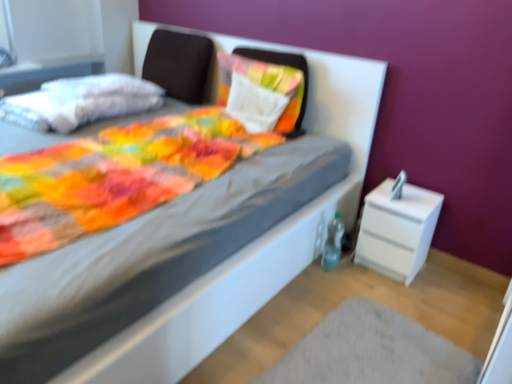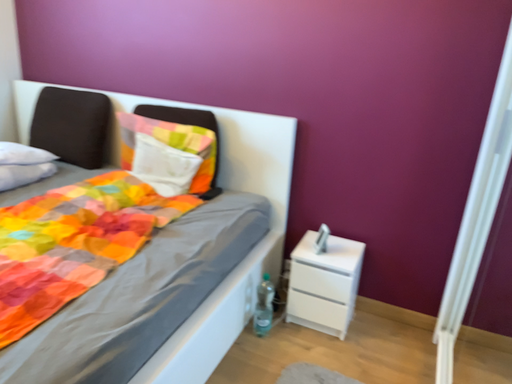
Question: How did the camera likely rotate when shooting the video?

Choices:
 (A) rotated right
 (B) rotated left

Answer: (A)